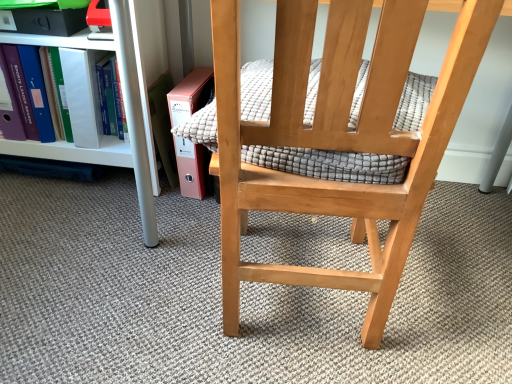
Question: Does textured gray quilt at center touch white plastic shelf at left?

Choices:
 (A) yes
 (B) no

Answer: (B)

Question: Is textured gray quilt at center to the left of white plastic shelf at left from the viewer's perspective?

Choices:
 (A) yes
 (B) no

Answer: (B)

Question: Is textured gray quilt at center not inside white plastic shelf at left?

Choices:
 (A) yes
 (B) no

Answer: (A)

Question: Is textured gray quilt at center positioned in front of white plastic shelf at left?

Choices:
 (A) no
 (B) yes

Answer: (B)

Question: Is textured gray quilt at center facing towards white plastic shelf at left?

Choices:
 (A) no
 (B) yes

Answer: (A)

Question: Looking at their shapes, would you say natural wood chair at center is wider or thinner than textured gray quilt at center?

Choices:
 (A) thin
 (B) wide

Answer: (B)

Question: Visually, is natural wood chair at center positioned to the left or to the right of textured gray quilt at center?

Choices:
 (A) left
 (B) right

Answer: (A)

Question: In the image, is natural wood chair at center positioned in front of or behind textured gray quilt at center?

Choices:
 (A) front
 (B) behind

Answer: (A)

Question: Is natural wood chair at center inside the boundaries of textured gray quilt at center, or outside?

Choices:
 (A) outside
 (B) inside

Answer: (A)

Question: From the image's perspective, is pink cardboard book at lower left located above or below textured gray quilt at center?

Choices:
 (A) below
 (B) above

Answer: (B)

Question: Based on their sizes in the image, would you say pink cardboard book at lower left is bigger or smaller than textured gray quilt at center?

Choices:
 (A) small
 (B) big

Answer: (A)

Question: From a real-world perspective, is pink cardboard book at lower left above or below textured gray quilt at center?

Choices:
 (A) below
 (B) above

Answer: (A)

Question: Is pink cardboard book at lower left to the left or to the right of textured gray quilt at center in the image?

Choices:
 (A) left
 (B) right

Answer: (A)

Question: From a real-world perspective, is natural wood chair at center positioned above or below white plastic shelf at left?

Choices:
 (A) above
 (B) below

Answer: (A)

Question: Is point (224, 94) closer or farther from the camera than point (115, 157)?

Choices:
 (A) closer
 (B) farther

Answer: (A)